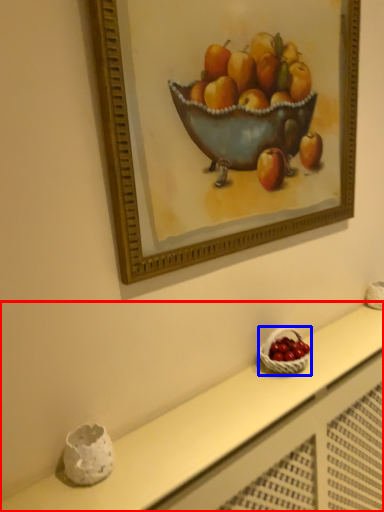
Question: Which object is closer to the camera taking this photo, table (highlighted by a red box) or basket (highlighted by a blue box)?

Choices:
 (A) table
 (B) basket

Answer: (A)